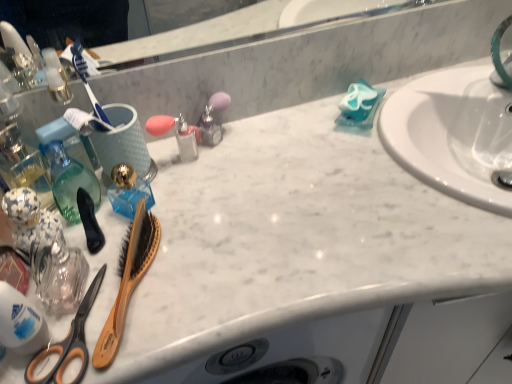
Locate an element on the screen. vacant space in front of blue matte soap at upper right, which appears as the 1th cleaning product when viewed from the back is located at coordinates (x=357, y=176).